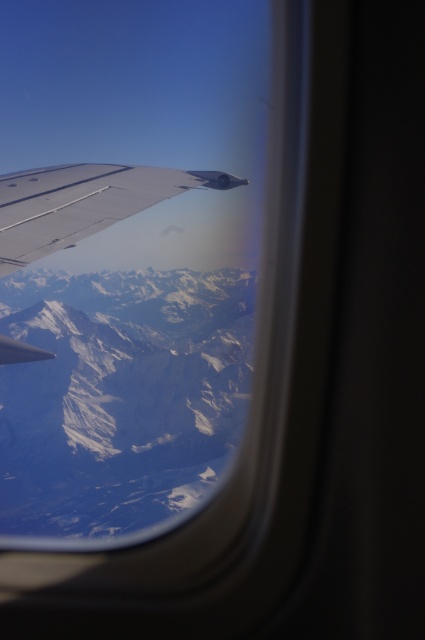
Question: Which point is farther from the camera taking this photo?

Choices:
 (A) (31, 273)
 (B) (90, 186)

Answer: (A)

Question: Does white snow-covered mountain range at center come behind silver metallic wing at upper left?

Choices:
 (A) yes
 (B) no

Answer: (A)

Question: Is white snow-covered mountain range at center in front of silver metallic wing at upper left?

Choices:
 (A) no
 (B) yes

Answer: (A)

Question: Does white snow-covered mountain range at center appear over silver metallic wing at upper left?

Choices:
 (A) yes
 (B) no

Answer: (B)